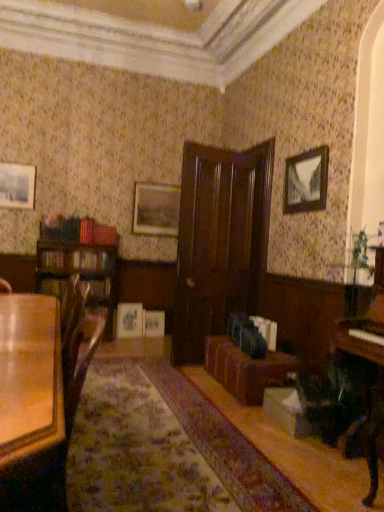
Question: Can you confirm if matte white picture frame at center, acting as the 2th picture frame starting from the left, is taller than matte silver picture frame at center, the 3th picture frame in the top-to-bottom sequence?

Choices:
 (A) yes
 (B) no

Answer: (B)

Question: Could you tell me if matte white picture frame at center, which is the third picture frame in front-to-back order, is turned towards matte silver picture frame at center, the 2th picture frame in the right-to-left sequence?

Choices:
 (A) no
 (B) yes

Answer: (A)

Question: Is matte white picture frame at center, which appears as the second picture frame when ordered from the bottom, further to camera compared to matte silver picture frame at center, which is the 4th picture frame in left-to-right order?

Choices:
 (A) yes
 (B) no

Answer: (B)

Question: Is matte white picture frame at center, marked as the fourth picture frame in a right-to-left arrangement, smaller than matte silver picture frame at center, the 2th picture frame from the back?

Choices:
 (A) no
 (B) yes

Answer: (B)

Question: Is matte white picture frame at center, which appears as the second picture frame when ordered from the bottom, at the left side of matte silver picture frame at center, which is the third picture frame from bottom to top?

Choices:
 (A) yes
 (B) no

Answer: (A)

Question: Considering the relative positions of matte white picture frame at center, which appears as the second picture frame when ordered from the bottom, and matte silver picture frame at center, positioned as the fourth picture frame in front-to-back order, in the image provided, is matte white picture frame at center, which appears as the second picture frame when ordered from the bottom, in front of matte silver picture frame at center, positioned as the fourth picture frame in front-to-back order,?

Choices:
 (A) yes
 (B) no

Answer: (A)

Question: Considering the relative sizes of glossy wood table at lower left and brown leather couch at center in the image provided, is glossy wood table at lower left thinner than brown leather couch at center?

Choices:
 (A) no
 (B) yes

Answer: (A)

Question: From a real-world perspective, is glossy wood table at lower left on top of brown leather couch at center?

Choices:
 (A) no
 (B) yes

Answer: (B)

Question: From a real-world perspective, is glossy wood table at lower left located beneath brown leather couch at center?

Choices:
 (A) yes
 (B) no

Answer: (B)

Question: Does glossy wood table at lower left come in front of brown leather couch at center?

Choices:
 (A) yes
 (B) no

Answer: (A)

Question: Is glossy wood table at lower left to the right of brown leather couch at center from the viewer's perspective?

Choices:
 (A) no
 (B) yes

Answer: (A)

Question: Is glossy wood table at lower left oriented away from brown leather couch at center?

Choices:
 (A) yes
 (B) no

Answer: (B)

Question: Does matte silver picture frame at center, which is the third picture frame from bottom to top, have a larger size compared to glossy wood table at lower left?

Choices:
 (A) yes
 (B) no

Answer: (B)